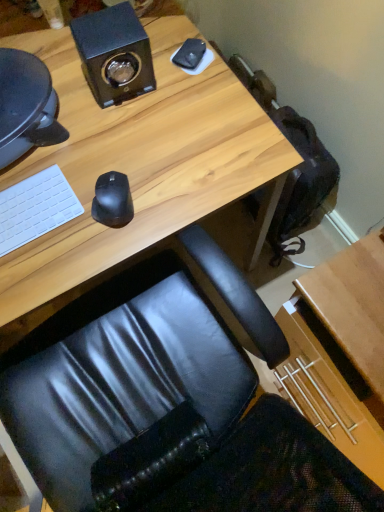
I want to click on vacant region below white matte keyboard at left (from a real-world perspective), so click(28, 215).